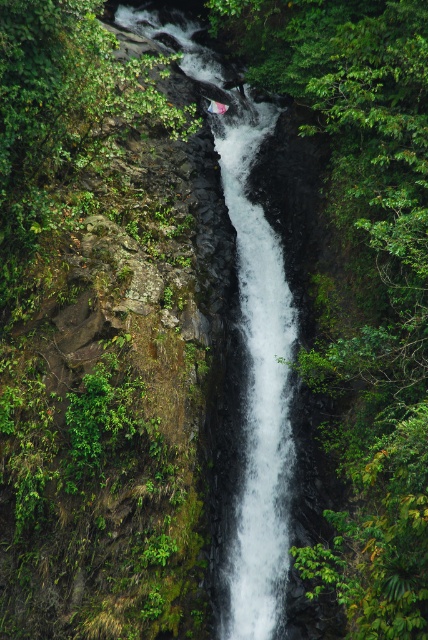
Image resolution: width=428 pixels, height=640 pixels. What do you see at coordinates (258, 387) in the screenshot? I see `white frothy water at center` at bounding box center [258, 387].

Is point (275, 404) positioned after point (249, 285)?

That is False.

Between point (258, 509) and point (270, 524), which one is positioned in front?

Point (270, 524) is more forward.

Where is `white frothy water at center`? This screenshot has height=640, width=428. white frothy water at center is located at coordinates (258, 387).